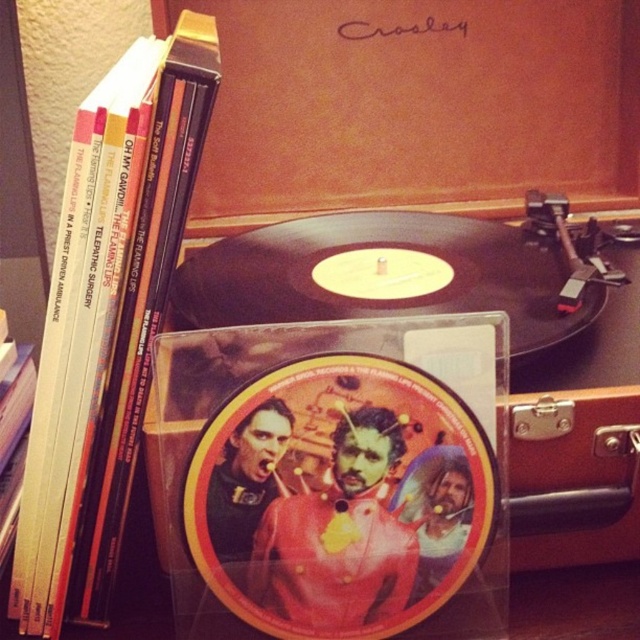
Question: Which of the following is the farthest from the observer?

Choices:
 (A) hardcover book at left
 (B) matte vinyl record at center

Answer: (B)

Question: Does matte vinyl record at center appear over hardcover book at left?

Choices:
 (A) no
 (B) yes

Answer: (A)

Question: Is matte vinyl record at center bigger than hardcover book at left?

Choices:
 (A) yes
 (B) no

Answer: (B)

Question: Which point is farther from the camera taking this photo?

Choices:
 (A) (93, 467)
 (B) (230, 611)

Answer: (A)

Question: Is matte vinyl record at center above hardcover book at left?

Choices:
 (A) no
 (B) yes

Answer: (A)

Question: Which of the following is the closest to the observer?

Choices:
 (A) (84, 589)
 (B) (408, 372)

Answer: (B)